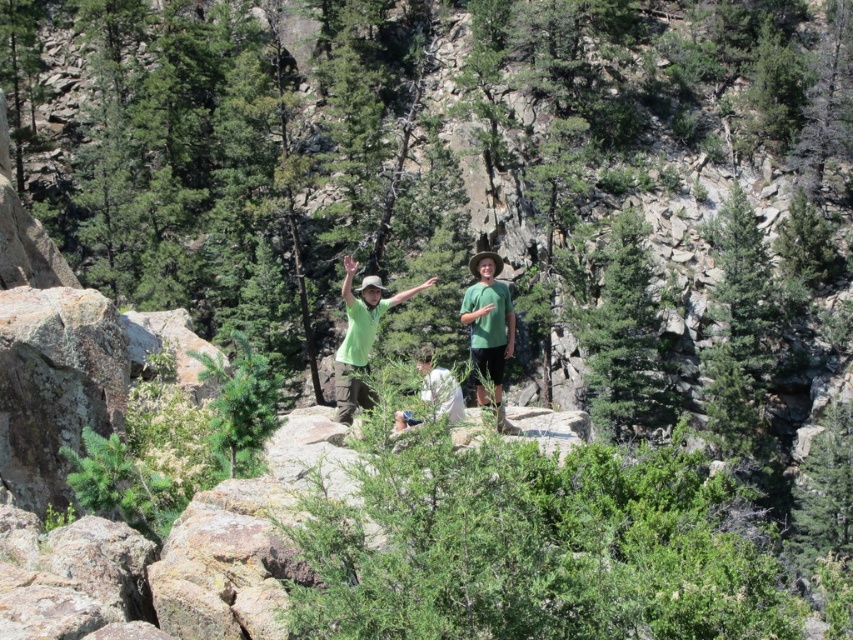
Question: Which point is farther to the camera?

Choices:
 (A) (340, 358)
 (B) (422, 394)

Answer: (A)

Question: Can you confirm if green matte shirt at center is smaller than white cotton shirt at center?

Choices:
 (A) no
 (B) yes

Answer: (A)

Question: Is green matte shirt at center in front of white cotton shirt at center?

Choices:
 (A) yes
 (B) no

Answer: (B)

Question: From the image, what is the correct spatial relationship of green matte shirt at center in relation to white cotton shirt at center?

Choices:
 (A) below
 (B) above

Answer: (B)

Question: Among these objects, which one is farthest from the camera?

Choices:
 (A) green matte shirt at center
 (B) white cotton shirt at center

Answer: (A)